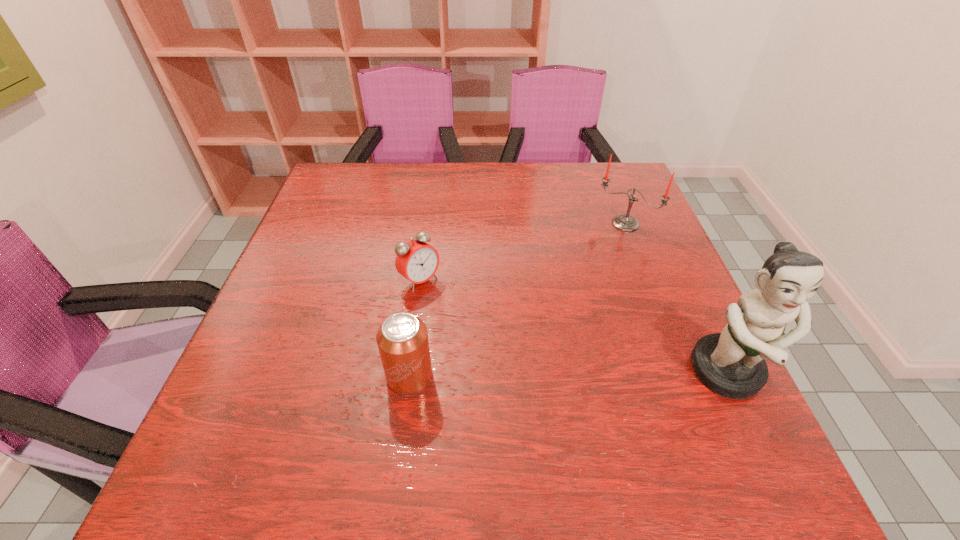
What are the coordinates of `vacant space on the desktop that is between the third tallest object and the figurine and is positioned on the front-facing side of the candle` in the screenshot? It's located at pos(528,375).

The height and width of the screenshot is (540, 960). What are the coordinates of `vacant space on the desktop that is between the second shortest object and the tallest object and is positioned on the front-facing side of the shortest object` in the screenshot? It's located at (526, 375).